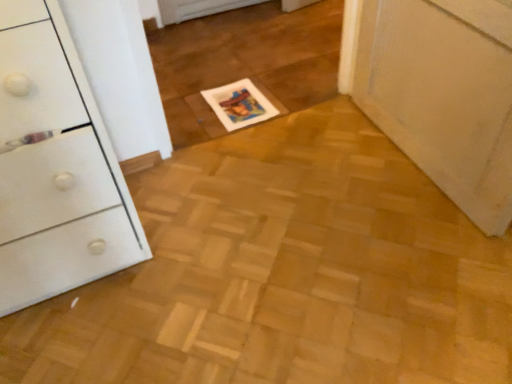
Locate an element on the screen. The image size is (512, 384). vacant area that is situated to the right of white glossy chest of drawers at left is located at coordinates (212, 229).